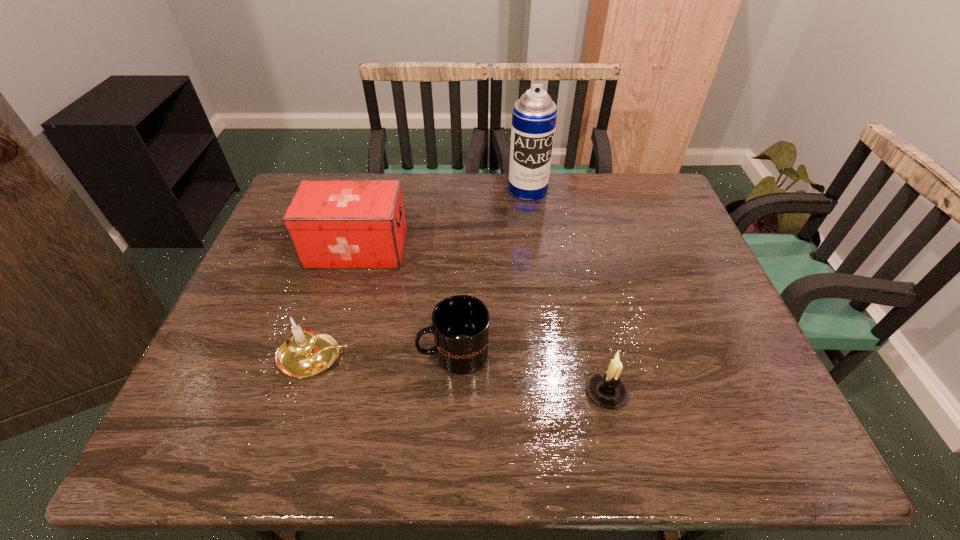
Locate an element on the screen. This screenshot has width=960, height=540. vacant region between the first-aid kit and the left candle holder is located at coordinates (336, 303).

Where is `the fourth closest object to the left candle holder`? Image resolution: width=960 pixels, height=540 pixels. the fourth closest object to the left candle holder is located at coordinates (534, 115).

I want to click on object that can be found as the second closest to the second farthest object, so click(x=305, y=353).

In order to click on vacant region that satisfies the following two spatial constraints: 1. on the back side of the right candle holder; 2. on the handle side of the left candle holder in this screenshot , I will do `click(599, 357)`.

Image resolution: width=960 pixels, height=540 pixels. I want to click on vacant space that satisfies the following two spatial constraints: 1. on the handle side of the fourth nearest object; 2. on the back side of the rightmost object, so click(316, 392).

The width and height of the screenshot is (960, 540). I want to click on free point that satisfies the following two spatial constraints: 1. on the label side of the tallest object; 2. on the handle side of the left candle holder, so click(549, 357).

Locate an element on the screen. vacant space that satisfies the following two spatial constraints: 1. with the handle on the side of the right candle holder; 2. on the left side of the mug is located at coordinates (452, 392).

The image size is (960, 540). I want to click on vacant point that satisfies the following two spatial constraints: 1. on the label side of the tallest object; 2. with the handle on the side of the third object from left to right, so click(549, 353).

The width and height of the screenshot is (960, 540). Find the location of `free location that satisfies the following two spatial constraints: 1. on the handle side of the left candle holder; 2. on the back side of the rightmost object`. free location that satisfies the following two spatial constraints: 1. on the handle side of the left candle holder; 2. on the back side of the rightmost object is located at coordinates (303, 392).

The width and height of the screenshot is (960, 540). What are the coordinates of `free space in the image that satisfies the following two spatial constraints: 1. on the back side of the right candle holder; 2. with the handle on the side of the mug` in the screenshot? It's located at (598, 353).